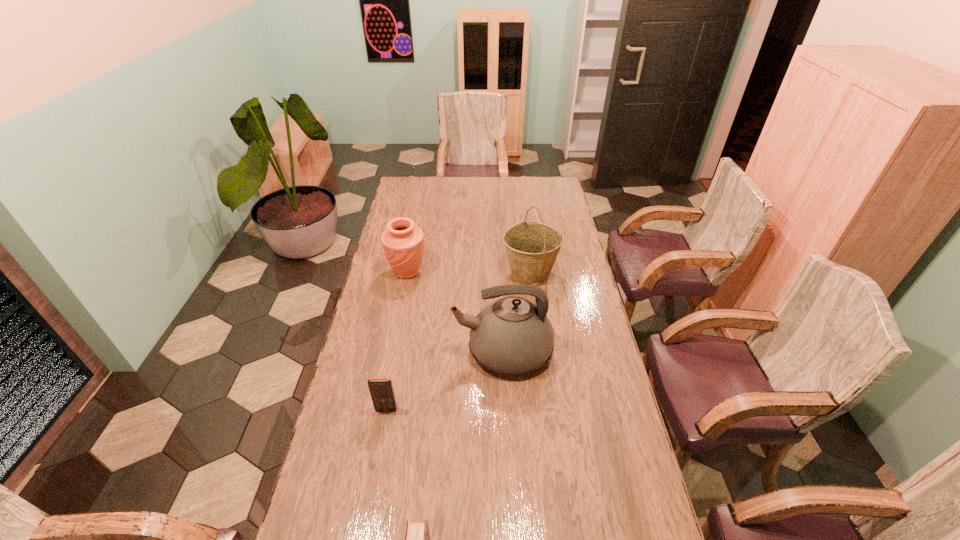
Find the location of a particular element. This screenshot has height=540, width=960. wine bucket is located at coordinates (532, 247).

Identify the location of the third farthest object. The height and width of the screenshot is (540, 960). (511, 335).

You are a GUI agent. You are given a task and a screenshot of the screen. Output one action in this format:
    pyautogui.click(x=<x>, y=<y>)
    Task: Click on the vase
    
    Given the screenshot: What is the action you would take?
    pyautogui.click(x=403, y=243)

Where is `the second nearest object`? The width and height of the screenshot is (960, 540). the second nearest object is located at coordinates (381, 390).

Identify the location of vacant area located 0.340m on the back of the wine bucket. (522, 217).

Where is `vacant space positioned at the spout of the third nearest object`? Image resolution: width=960 pixels, height=540 pixels. vacant space positioned at the spout of the third nearest object is located at coordinates (372, 352).

What are the coordinates of `free space located at the spout of the third nearest object` in the screenshot? It's located at (355, 352).

The height and width of the screenshot is (540, 960). I want to click on vacant space located at the spout of the third nearest object, so click(364, 352).

I want to click on free space located 0.370m on the front of the vase, so click(x=391, y=355).

You are a GUI agent. You are given a task and a screenshot of the screen. Output one action in this format:
    pyautogui.click(x=<x>, y=<y>)
    Task: Click on the vacant space located on the screen of the cellular telephone
    
    Given the screenshot: What is the action you would take?
    pyautogui.click(x=373, y=478)